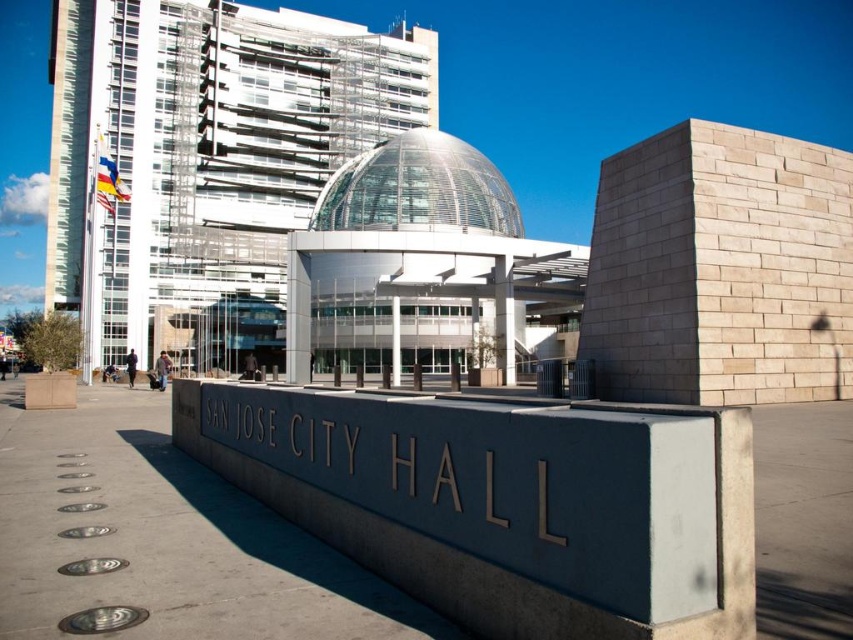
From the picture: You are standing in front of San Jose City Hall and see two points marked on the wall. The first point is at coordinates point (416, 484) and the second is at point (369, 209). Which point is closer to you?

Point (416, 484) is closer to the viewer than point (369, 209).

You are a city planner assessing the visual impact of the gray concrete sign at center and the transparent glass dome at center. Which object appears smaller in width when viewed from your current position?

The gray concrete sign at center appears smaller in width than the transparent glass dome at center because its width is less than that of the dome.

You are standing in front of San Jose City Hall and want to take a photo that includes both the gray concrete sign at center and the transparent glass dome at center. Which object will appear larger in the photo?

The gray concrete sign at center will appear larger in the photo because it is closer to the viewer than the transparent glass dome at center.